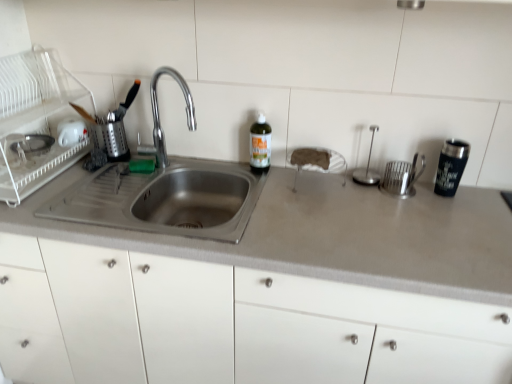
Where is `free point to the right of white matte sponge at center, which appears as the 3th appliance when viewed from the right`? Image resolution: width=512 pixels, height=384 pixels. free point to the right of white matte sponge at center, which appears as the 3th appliance when viewed from the right is located at coordinates (360, 192).